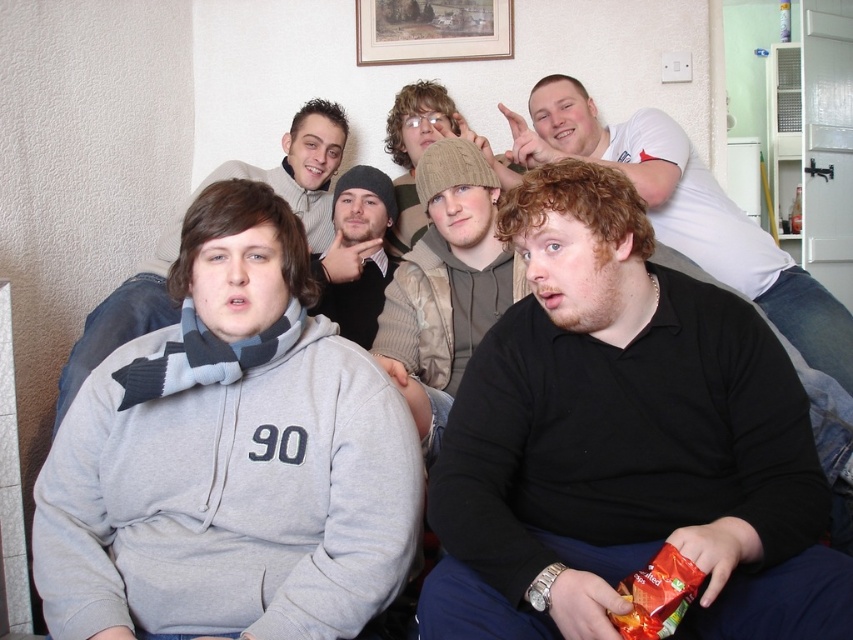
Question: Does gray fleece hoodie at left have a greater width compared to black matte shirt at lower right?

Choices:
 (A) no
 (B) yes

Answer: (A)

Question: Which point is closer to the camera?

Choices:
 (A) (375, 305)
 (B) (541, 154)

Answer: (B)

Question: Which object is positioned farthest from the black matte shirt at lower right?

Choices:
 (A) gray fleece hoodie at left
 (B) gray fleece hoodie at center
 (C) black knit cap at center

Answer: (A)

Question: Is black matte shirt at center further to camera compared to black matte shirt at lower right?

Choices:
 (A) yes
 (B) no

Answer: (B)

Question: Is black matte shirt at lower right in front of gray fleece hoodie at center?

Choices:
 (A) no
 (B) yes

Answer: (A)

Question: Which point is closer to the camera?

Choices:
 (A) gray fleece hoodie at left
 (B) black knit cap at center
 (C) black matte shirt at center

Answer: (C)